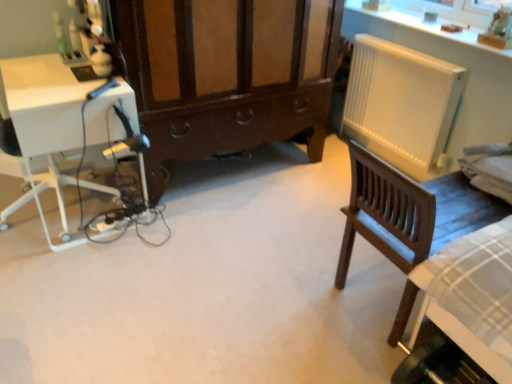
I want to click on vacant space that's between brown wood cabinet at center and white plastic computer desk at left, so click(222, 201).